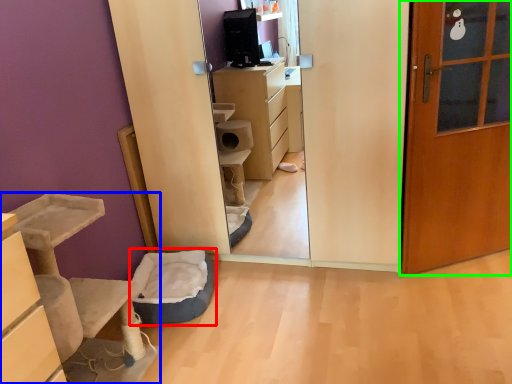
Question: Which object is the closest to the infant bed (highlighted by a red box)? Choose among these: furniture (highlighted by a blue box) or door (highlighted by a green box).

Choices:
 (A) furniture
 (B) door

Answer: (A)